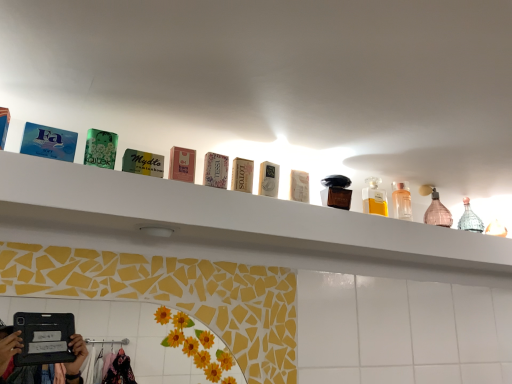
Question: Considering the positions of point (346, 205) and point (53, 160), is point (346, 205) closer or farther from the camera than point (53, 160)?

Choices:
 (A) farther
 (B) closer

Answer: (A)

Question: Choose the correct answer: Is shiny brown perfume at center, which is counted as the second toiletry, starting from the front, inside white glossy shelf at upper center or outside it?

Choices:
 (A) inside
 (B) outside

Answer: (B)

Question: Considering the real-world distances, which object is farthest from the white glossy shelf at upper center?

Choices:
 (A) white cardboard box at center
 (B) pink glass bottle at upper right, marked as the 2th mouthwash in a front-to-back arrangement
 (C) shiny brown perfume at center, the 2th toiletry from the left
 (D) matte pink soap at center, acting as the first toiletry starting from the front
 (E) clear glass bottle at upper right, positioned as the 1th toiletry in back-to-front order

Answer: (B)

Question: Which object is the closest to the translucent glass bottle at upper center, positioned as the first mouthwash in front-to-back order?

Choices:
 (A) matte pink soap at center, positioned as the 3th toiletry in back-to-front order
 (B) white glossy shelf at upper center
 (C) white cardboard box at center
 (D) pink glass bottle at upper right, which appears as the first mouthwash when viewed from the back
 (E) shiny brown perfume at center, the second toiletry viewed from the back

Answer: (E)